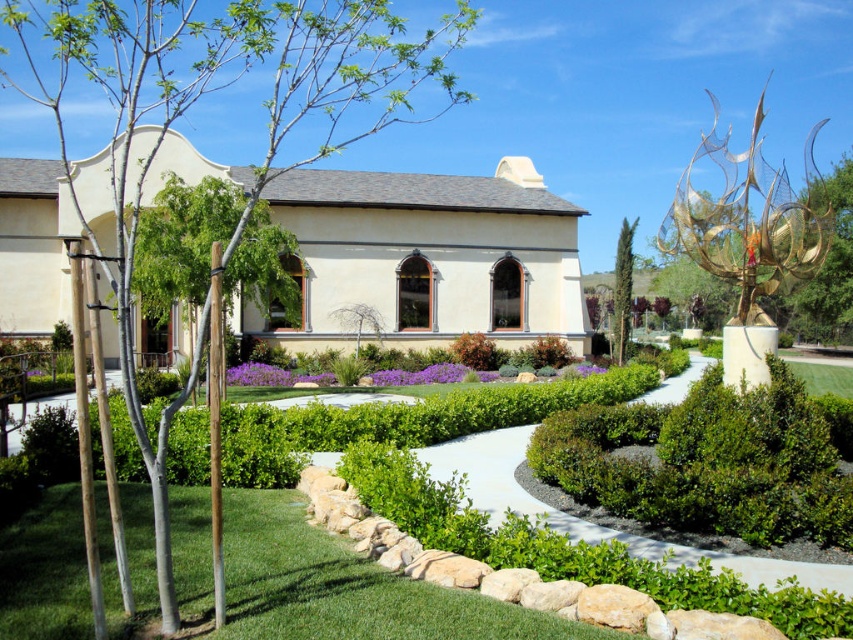
Question: Can you confirm if green leafy tree at left is wider than green textured cypress at center?

Choices:
 (A) no
 (B) yes

Answer: (B)

Question: Does green leafy tree at left have a greater width compared to green textured cypress at center?

Choices:
 (A) no
 (B) yes

Answer: (B)

Question: Which of these objects is positioned farthest from the green textured cypress at center?

Choices:
 (A) green leafy hedge at center
 (B) green leafy tree at left

Answer: (B)

Question: Does green leafy tree at left have a larger size compared to green textured cypress at center?

Choices:
 (A) yes
 (B) no

Answer: (A)

Question: Which object is the closest to the green grass at lower left?

Choices:
 (A) green leafy hedge at center
 (B) green textured cypress at center

Answer: (A)

Question: Which point appears farthest from the camera in this image?

Choices:
 (A) (585, 424)
 (B) (260, 513)
 (C) (631, 253)
 (D) (456, 33)

Answer: (D)